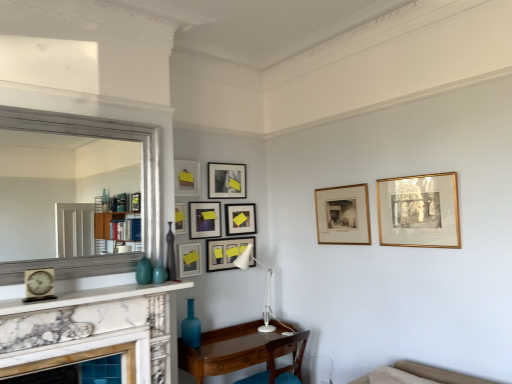
Where is `free space above wooden picture frame at center, arranged as the 2th picture frame when viewed from the right (from a real-world perspective)`? The width and height of the screenshot is (512, 384). free space above wooden picture frame at center, arranged as the 2th picture frame when viewed from the right (from a real-world perspective) is located at coordinates (344, 183).